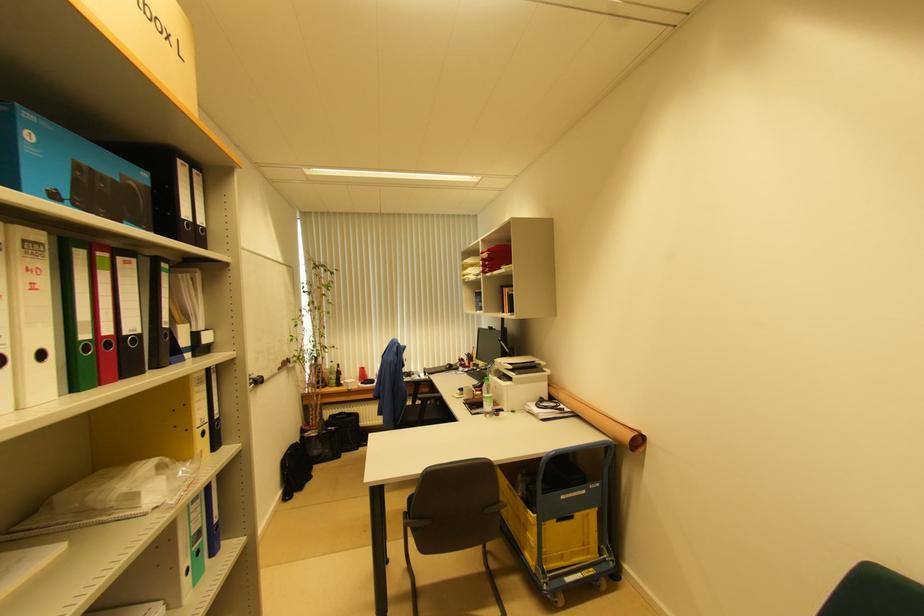
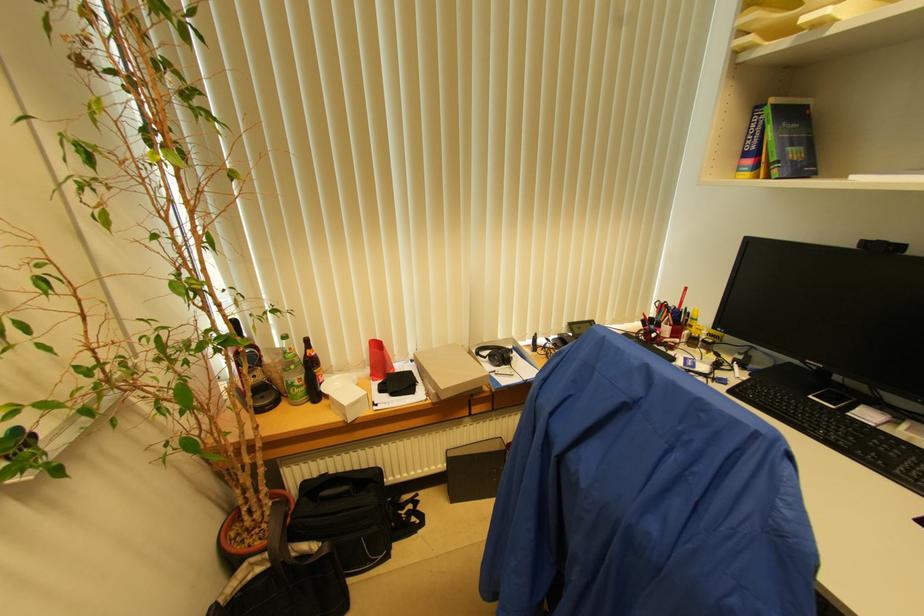
Find the pixel in the second image that matches (x=320, y=435) in the first image.

(273, 561)